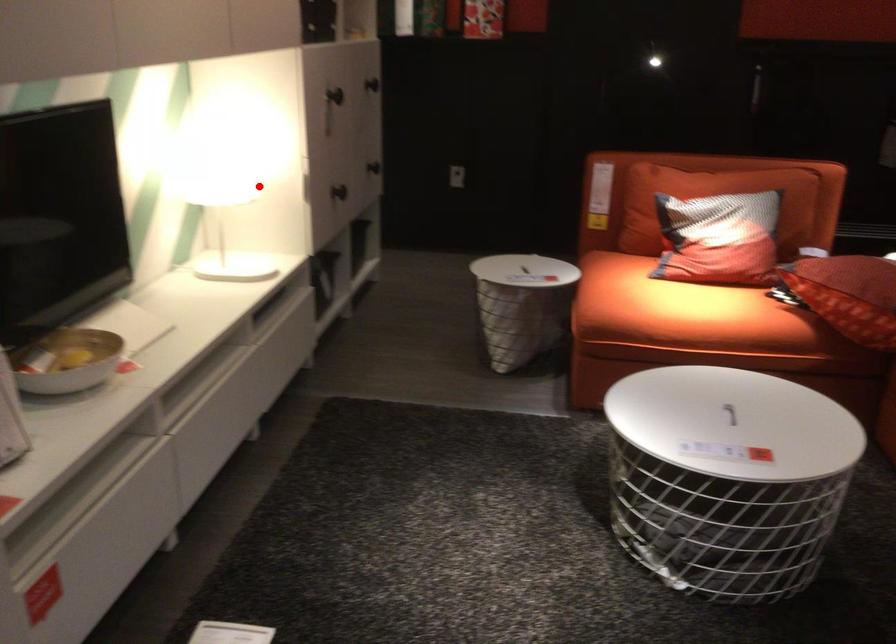
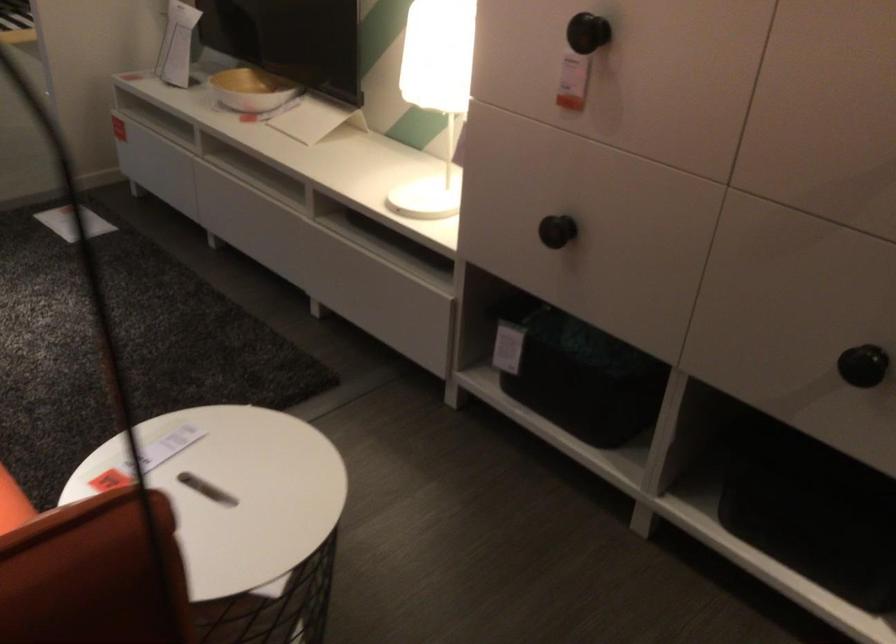
Locate, in the second image, the point that corresponds to the highlighted location in the first image.

(435, 93)